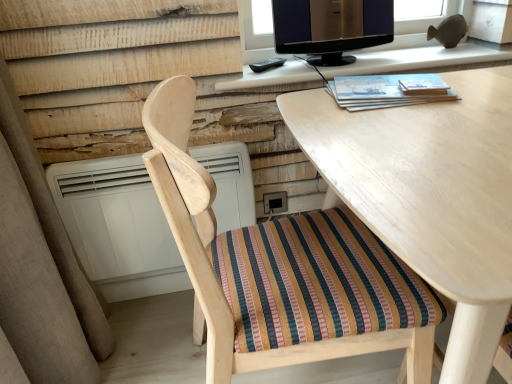
Question: Is white plastic air conditioner at lower left wider than wooden chair with striped cushion at center?

Choices:
 (A) no
 (B) yes

Answer: (A)

Question: From a real-world perspective, is white plastic air conditioner at lower left below wooden chair with striped cushion at center?

Choices:
 (A) yes
 (B) no

Answer: (A)

Question: From the image's perspective, would you say white plastic air conditioner at lower left is positioned over wooden chair with striped cushion at center?

Choices:
 (A) no
 (B) yes

Answer: (B)

Question: Can you confirm if white plastic air conditioner at lower left is shorter than wooden chair with striped cushion at center?

Choices:
 (A) no
 (B) yes

Answer: (B)

Question: From a real-world perspective, is white plastic air conditioner at lower left on wooden chair with striped cushion at center?

Choices:
 (A) yes
 (B) no

Answer: (B)

Question: From the image's perspective, is white plastic air conditioner at lower left located beneath wooden chair with striped cushion at center?

Choices:
 (A) no
 (B) yes

Answer: (A)

Question: Does wooden chair with striped cushion at center have a smaller size compared to black glossy monitor at upper center?

Choices:
 (A) no
 (B) yes

Answer: (A)

Question: Does wooden chair with striped cushion at center have a greater width compared to black glossy monitor at upper center?

Choices:
 (A) yes
 (B) no

Answer: (A)

Question: From the image's perspective, is wooden chair with striped cushion at center under black glossy monitor at upper center?

Choices:
 (A) yes
 (B) no

Answer: (A)

Question: Is wooden chair with striped cushion at center positioned behind black glossy monitor at upper center?

Choices:
 (A) no
 (B) yes

Answer: (A)

Question: Considering the relative sizes of wooden chair with striped cushion at center and black glossy monitor at upper center in the image provided, is wooden chair with striped cushion at center bigger than black glossy monitor at upper center?

Choices:
 (A) yes
 (B) no

Answer: (A)

Question: Can you confirm if wooden chair with striped cushion at center is shorter than black glossy monitor at upper center?

Choices:
 (A) yes
 (B) no

Answer: (B)

Question: Is matte black monitor at upper center oriented towards light wood desk at center?

Choices:
 (A) yes
 (B) no

Answer: (B)